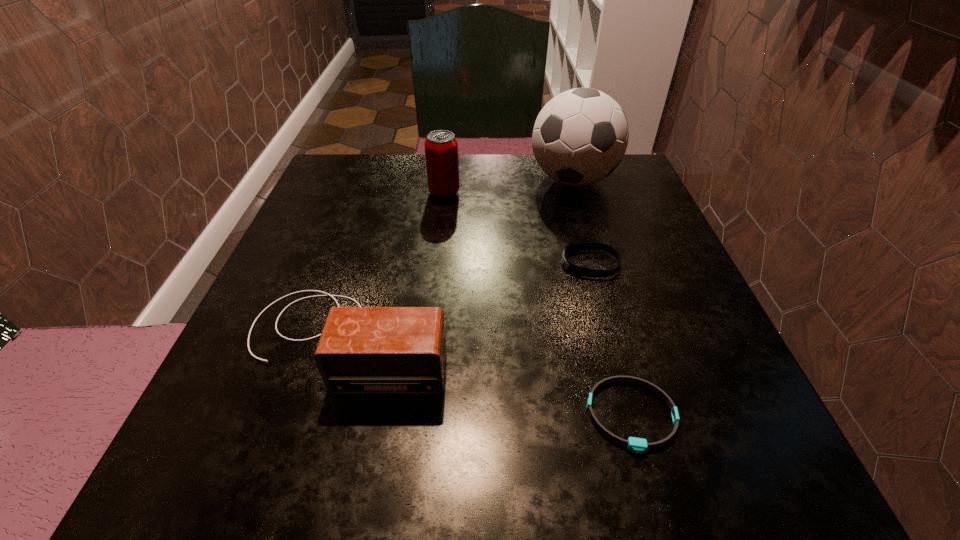
You are a GUI agent. You are given a task and a screenshot of the screen. Output one action in this format:
    pyautogui.click(x=<x>, y=<y>)
    Task: Click on the vacant space located 0.390m on the display of the farther wristband
    
    Given the screenshot: What is the action you would take?
    pyautogui.click(x=353, y=265)

You are a GUI agent. You are given a task and a screenshot of the screen. Output one action in this format:
    pyautogui.click(x=<x>, y=<y>)
    Task: Click on the free space located on the display of the farther wristband
    
    Given the screenshot: What is the action you would take?
    pyautogui.click(x=358, y=265)

The image size is (960, 540). I want to click on free point located on the display of the farther wristband, so [514, 265].

Identify the location of soccer ball that is positioned at the far edge. (580, 136).

Locate an element on the screen. This screenshot has width=960, height=540. can that is at the far edge is located at coordinates (441, 147).

The width and height of the screenshot is (960, 540). In order to click on object at the near edge in this screenshot , I will do `click(635, 445)`.

The height and width of the screenshot is (540, 960). What are the coordinates of `object located at the left edge` in the screenshot? It's located at (362, 350).

The height and width of the screenshot is (540, 960). I want to click on soccer ball present at the right edge, so click(580, 136).

Where is `object that is at the far right corner`? Image resolution: width=960 pixels, height=540 pixels. object that is at the far right corner is located at coordinates pos(580,136).

Identify the location of object at the near right corner. Image resolution: width=960 pixels, height=540 pixels. (635, 445).